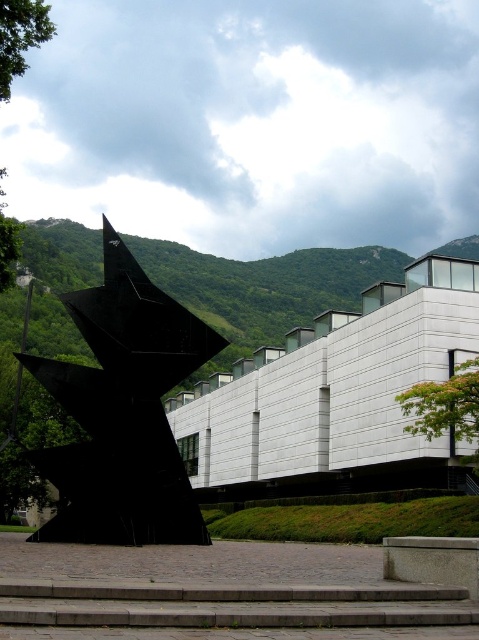
Question: Among these objects, which one is nearest to the camera?

Choices:
 (A) black polished sculpture at center
 (B) green leafy hillside at left

Answer: (A)

Question: Can you confirm if black polished sculpture at center is positioned below green leafy hillside at left?

Choices:
 (A) no
 (B) yes

Answer: (B)

Question: Which point appears farthest from the camera in this image?

Choices:
 (A) (67, 600)
 (B) (91, 516)
 (C) (22, 252)

Answer: (C)

Question: Estimate the real-world distances between objects in this image. Which object is closer to the black polished sculpture at center?

Choices:
 (A) green leafy hillside at left
 (B) gray concrete stairs at lower center

Answer: (B)

Question: Is the position of black polished sculpture at center less distant than that of gray concrete stairs at lower center?

Choices:
 (A) yes
 (B) no

Answer: (B)

Question: Does black polished sculpture at center appear on the right side of green leafy hillside at left?

Choices:
 (A) yes
 (B) no

Answer: (B)